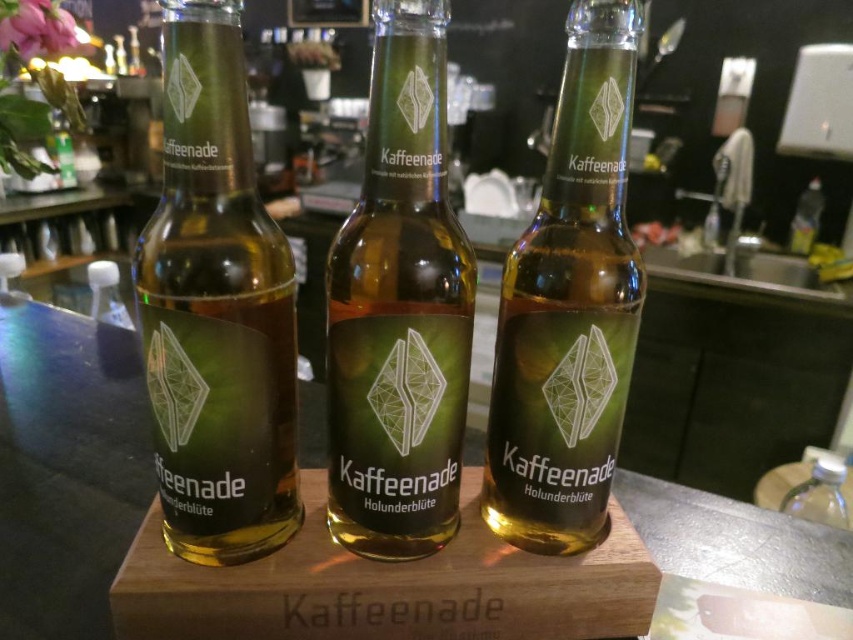
You are a bartender preparing to restock bottles on a narrow shelf that can only accommodate bottles with a diameter of 10 cm or less. You have two bottles to place there. Looking at the green glass bottle at left and the green glass bottle at center, which one can fit on the shelf?

The green glass bottle at left is thinner than the green glass bottle at center. Since the shelf can only hold bottles with a diameter of 10 cm or less, the thinner bottle at left likely fits, while the thicker center bottle may be too wide.

You are a customer at a bar and want to choose between the green glass bottle at left and the transparent plastic bottle at lower right. Which one is positioned higher from the ground?

The green glass bottle at left is above the transparent plastic bottle at lower right, so it is positioned higher from the ground.